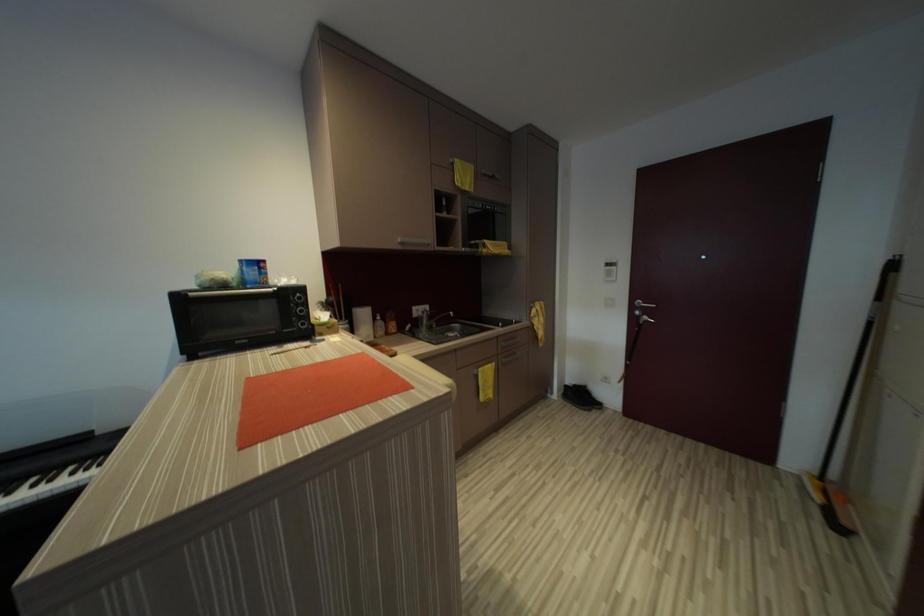
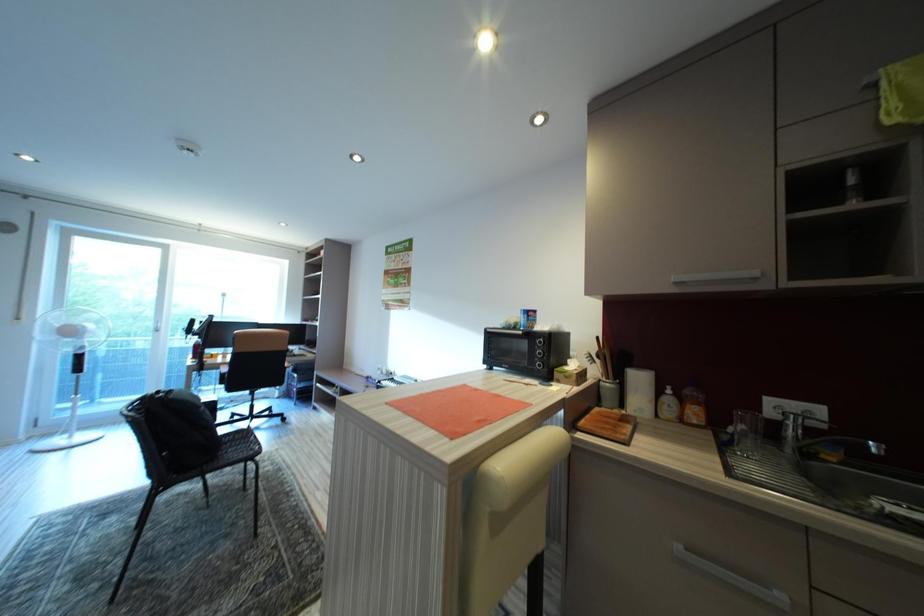
Question: The camera is either moving clockwise (left) or counter-clockwise (right) around the object. The first image is from the beginning of the video and the second image is from the end. Is the camera moving left or right when shooting the video?

Choices:
 (A) Left
 (B) Right

Answer: (B)